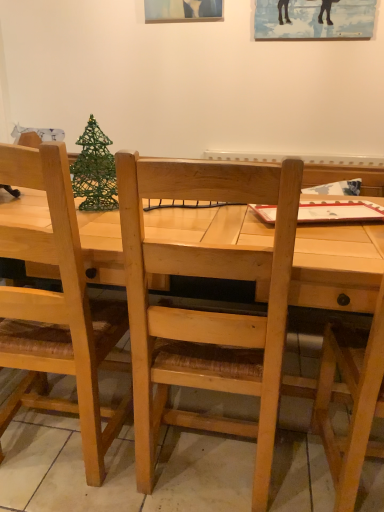
Describe the element at coordinates (314, 19) in the screenshot. I see `wooden picture frame at upper center` at that location.

In the scene shown: In order to face natural wood chair at left, the 1th chair from the left, should I rotate leftwards or rightwards?

Turn left approximately 19.111 degrees to face it.

Describe the element at coordinates (57, 310) in the screenshot. The image size is (384, 512). I see `natural wood chair at left, which is the second chair from right to left` at that location.

Where is `light wood table at center`? light wood table at center is located at coordinates (202, 474).

Based on the photo, what is the approximate width of green wire christmas tree at upper left?

green wire christmas tree at upper left is 4.49 inches wide.

Locate an element on the screen. The width and height of the screenshot is (384, 512). natural wood chair at right, placed as the 2th chair when sorted from left to right is located at coordinates (351, 399).

Is point (183, 406) positioned behind point (93, 169)?

Yes.

From the picture: How different are the orientations of light wood table at center and green wire christmas tree at upper left in degrees?

light wood table at center and green wire christmas tree at upper left are facing 15.4 degrees away from each other.

Does light wood table at center come behind green wire christmas tree at upper left?

No, the depth of light wood table at center is less than that of green wire christmas tree at upper left.

From the image's perspective, who appears lower, light wood table at center or wooden picture frame at upper center?

light wood table at center.

Is light wood table at center facing away from wooden picture frame at upper center?

No, light wood table at center's orientation is not away from wooden picture frame at upper center.

Considering the relative positions of light wood table at center and wooden picture frame at upper center in the image provided, is light wood table at center behind wooden picture frame at upper center?

No, the depth of light wood table at center is less than that of wooden picture frame at upper center.

From a real-world perspective, who is located lower, wooden picture frame at upper center or natural wood chair at left, which is the second chair from right to left?

natural wood chair at left, which is the second chair from right to left, from a real-world perspective.

From the image's perspective, is wooden picture frame at upper center on top of natural wood chair at left, the 1th chair from the left?

Correct, wooden picture frame at upper center appears higher than natural wood chair at left, the 1th chair from the left, in the image.

Which is more to the left, wooden picture frame at upper center or natural wood chair at left, the 1th chair from the left?

natural wood chair at left, the 1th chair from the left, is more to the left.

Does green wire christmas tree at upper left have a larger size compared to natural wood chair at left, the 1th chair from the left?

No.

From a real-world perspective, between green wire christmas tree at upper left and natural wood chair at left, which is the second chair from right to left, who is vertically lower?

natural wood chair at left, which is the second chair from right to left.

Is green wire christmas tree at upper left aimed at natural wood chair at left, the 1th chair from the left?

Yes, green wire christmas tree at upper left is facing natural wood chair at left, the 1th chair from the left.

Considering the positions of objects green wire christmas tree at upper left and natural wood chair at left, which is the second chair from right to left, in the image provided, who is more to the left, green wire christmas tree at upper left or natural wood chair at left, which is the second chair from right to left,?

natural wood chair at left, which is the second chair from right to left.

Consider the image. Is natural wood chair at right, which is the first chair from right to left, positioned with its back to wooden picture frame at upper center?

No.

Find the location of `picture frame above the natural wood chair at right, which is the first chair from right to left (from the image's perspective)`. picture frame above the natural wood chair at right, which is the first chair from right to left (from the image's perspective) is located at coordinates (314, 19).

What's the angular difference between natural wood chair at right, placed as the 2th chair when sorted from left to right, and wooden picture frame at upper center's facing directions?

179 degrees separate the facing orientations of natural wood chair at right, placed as the 2th chair when sorted from left to right, and wooden picture frame at upper center.

From the picture: Is there a large distance between natural wood chair at right, which is the first chair from right to left, and wooden picture frame at upper center?

Yes, natural wood chair at right, which is the first chair from right to left, and wooden picture frame at upper center are located far from each other.

In the image, there is a wooden picture frame at upper center. In order to click on christmas tree below it (from the image's perspective) in this screenshot , I will do `click(94, 170)`.

From the picture: Is green wire christmas tree at upper left positioned beyond the bounds of wooden picture frame at upper center?

green wire christmas tree at upper left lies outside wooden picture frame at upper center's area.

Based on the photo, from the image's perspective, between green wire christmas tree at upper left and wooden picture frame at upper center, which one is located above?

wooden picture frame at upper center is shown above in the image.

Based on their positions, is green wire christmas tree at upper left located to the left or right of wooden picture frame at upper center?

Based on their positions, green wire christmas tree at upper left is located to the left of wooden picture frame at upper center.

Which is in front, point (77, 395) or point (2, 197)?

The point (77, 395) is closer to the camera.

From the image's perspective, would you say natural wood chair at left, which is the second chair from right to left, is shown under light wood table at center?

Incorrect, from the image's perspective, natural wood chair at left, which is the second chair from right to left, is higher than light wood table at center.

How different are the orientations of natural wood chair at left, which is the second chair from right to left, and light wood table at center in degrees?

The angle between the facing direction of natural wood chair at left, which is the second chair from right to left, and the facing direction of light wood table at center is 177 degrees.

Where is `christmas tree on the left of light wood table at center`? christmas tree on the left of light wood table at center is located at coordinates pyautogui.click(x=94, y=170).

You are a GUI agent. You are given a task and a screenshot of the screen. Output one action in this format:
    pyautogui.click(x=<x>, y=<y>)
    Task: Click on the picture frame above the light wood table at center (from a real-world perspective)
    
    Given the screenshot: What is the action you would take?
    pyautogui.click(x=314, y=19)

Based on their spatial positions, is light wood table at center or wooden picture frame at upper center further from green wire christmas tree at upper left?

wooden picture frame at upper center is further to green wire christmas tree at upper left.

Based on their spatial positions, is natural wood chair at left, the 1th chair from the left, or green wire christmas tree at upper left further from natural wood chair at right, which is the first chair from right to left?

green wire christmas tree at upper left is further to natural wood chair at right, which is the first chair from right to left.

Looking at the image, which one is located closer to green wire christmas tree at upper left, natural wood chair at left, the 1th chair from the left, or wooden picture frame at upper center?

natural wood chair at left, the 1th chair from the left, is positioned closer to the anchor green wire christmas tree at upper left.

From the image, which object appears to be farther from light wood table at center, natural wood chair at left, which is the second chair from right to left, or natural wood chair at right, placed as the 2th chair when sorted from left to right?

natural wood chair at left, which is the second chair from right to left.

When comparing their distances from natural wood chair at left, which is the second chair from right to left, does green wire christmas tree at upper left or natural wood chair at right, placed as the 2th chair when sorted from left to right, seem further?

natural wood chair at right, placed as the 2th chair when sorted from left to right, is positioned further to the anchor natural wood chair at left, which is the second chair from right to left.

When comparing their distances from green wire christmas tree at upper left, does natural wood chair at right, which is the first chair from right to left, or light wood table at center seem closer?

Among the two, light wood table at center is located nearer to green wire christmas tree at upper left.

From the image, which object appears to be nearer to wooden picture frame at upper center, light wood table at center or natural wood chair at right, which is the first chair from right to left?

The object closer to wooden picture frame at upper center is natural wood chair at right, which is the first chair from right to left.

Looking at the image, which one is located further to green wire christmas tree at upper left, light wood table at center or natural wood chair at left, the 1th chair from the left?

light wood table at center is further to green wire christmas tree at upper left.

The height and width of the screenshot is (512, 384). I want to click on chair between wooden picture frame at upper center and light wood table at center from top to bottom, so click(57, 310).

At what (x,y) coordinates should I click in order to perform the action: click on chair that lies between green wire christmas tree at upper left and light wood table at center from top to bottom. Please return your answer as a coordinate pair (x, y). This screenshot has height=512, width=384. Looking at the image, I should click on (57, 310).

The width and height of the screenshot is (384, 512). Find the location of `christmas tree between wooden picture frame at upper center and light wood table at center from top to bottom`. christmas tree between wooden picture frame at upper center and light wood table at center from top to bottom is located at coordinates (94, 170).

Locate an element on the screen. This screenshot has width=384, height=512. desk between natural wood chair at left, which is the second chair from right to left, and natural wood chair at right, which is the first chair from right to left is located at coordinates (202, 474).